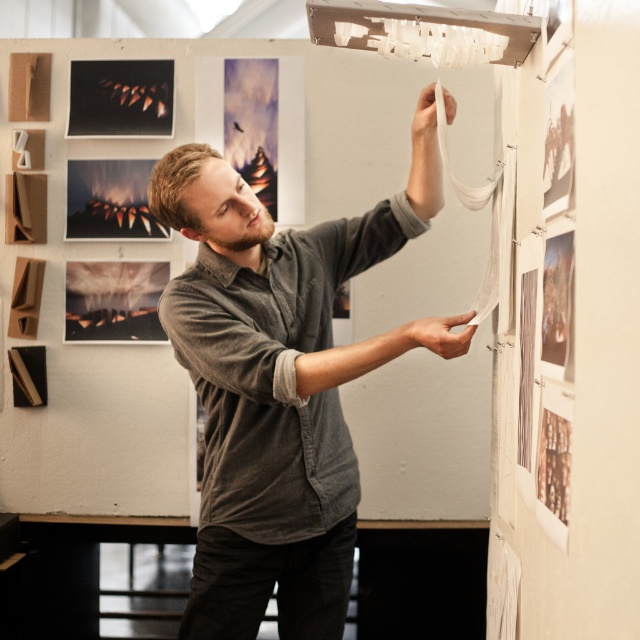
Based on the scene described, where is the gray cotton shirt at center in relation to the matte black photograph at lower left?

The gray cotton shirt at center is to the right of the matte black photograph at lower left.

You are an art student who wants to hang a new artwork between the matte black photograph at lower left and the matte black artwork at upper left. The new artwork is 5 inches wide. Can you fit it in the space between them?

The space between the matte black photograph at lower left and the matte black artwork at upper left is 7.13 inches, so yes, the new artwork which is 5 inches wide can fit in the space between them.

You are an observer looking at the scene. Can you tell me the position of the gray cotton shirt at center relative to the matte black photograph at lower left?

The gray cotton shirt at center is located below the matte black photograph at lower left.